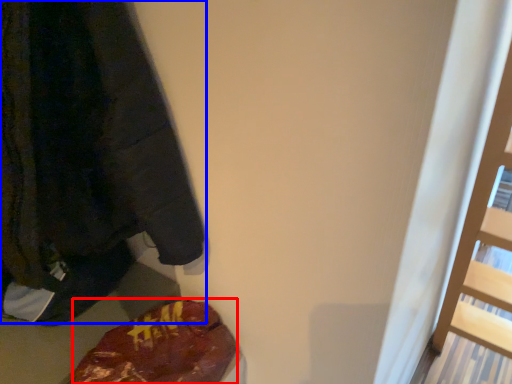
Question: Among these objects, which one is farthest to the camera, food (highlighted by a red box) or sweatshirt (highlighted by a blue box)?

Choices:
 (A) food
 (B) sweatshirt

Answer: (A)